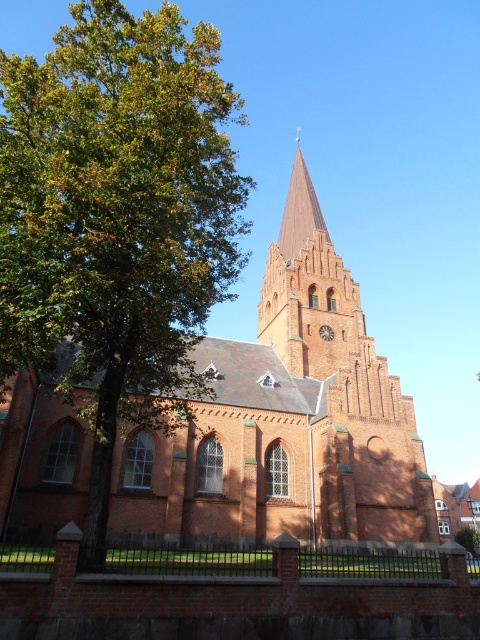
Question: Does red brick church at center have a larger size compared to brick clock at center?

Choices:
 (A) yes
 (B) no

Answer: (A)

Question: Which point appears farthest from the camera in this image?

Choices:
 (A) (304, 467)
 (B) (334, 332)

Answer: (B)

Question: Which point is farther to the camera?

Choices:
 (A) red brick church at center
 (B) green leafy tree at left
 (C) smooth red brick spire at center

Answer: (C)

Question: Does red brick church at center appear over brick clock at center?

Choices:
 (A) no
 (B) yes

Answer: (A)

Question: Which point appears closest to the camera in this image?

Choices:
 (A) (300, 323)
 (B) (312, 397)
 (C) (324, 339)
 (D) (215, 32)

Answer: (D)

Question: Is green leafy tree at left below red brick church at center?

Choices:
 (A) yes
 (B) no

Answer: (B)